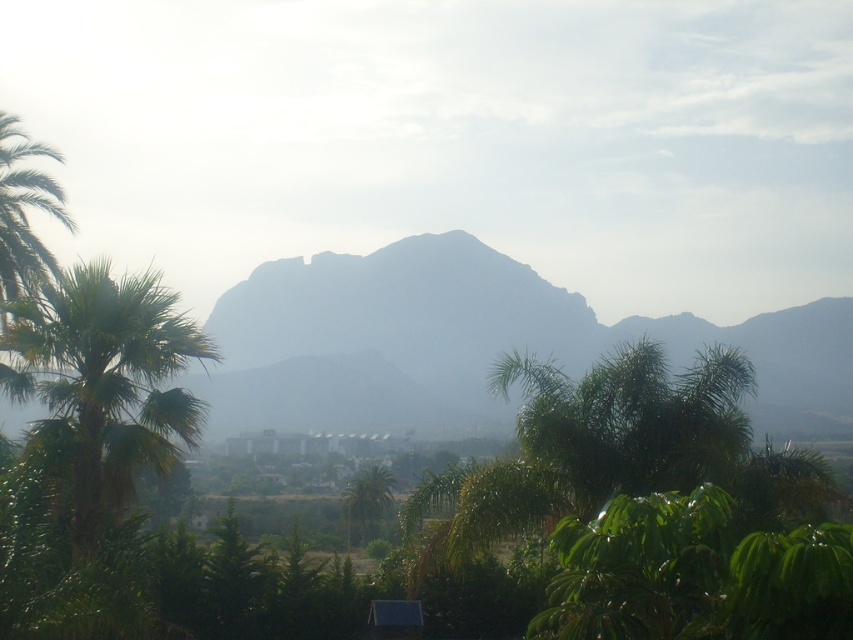
Question: Estimate the real-world distances between objects in this image. Which object is farther from the smokey gray mountain at center?

Choices:
 (A) green leafy palm at left
 (B) green leafy palm tree at center

Answer: (A)

Question: From the image, what is the correct spatial relationship of smokey gray mountain at center in relation to green leafy palm at left?

Choices:
 (A) right
 (B) left

Answer: (A)

Question: Which object is closer to the camera taking this photo?

Choices:
 (A) green leafy palm tree at left
 (B) green leafy palm tree at center

Answer: (A)

Question: Among these points, which one is nearest to the camera?

Choices:
 (A) (369, 515)
 (B) (839, 428)
 (C) (80, 476)
 (D) (39, 248)

Answer: (C)

Question: Does smokey gray mountain at center have a lesser width compared to green leafy palm tree at left?

Choices:
 (A) no
 (B) yes

Answer: (A)

Question: Can you confirm if green leafy palm at left is positioned below green leafy palm tree at left?

Choices:
 (A) yes
 (B) no

Answer: (A)